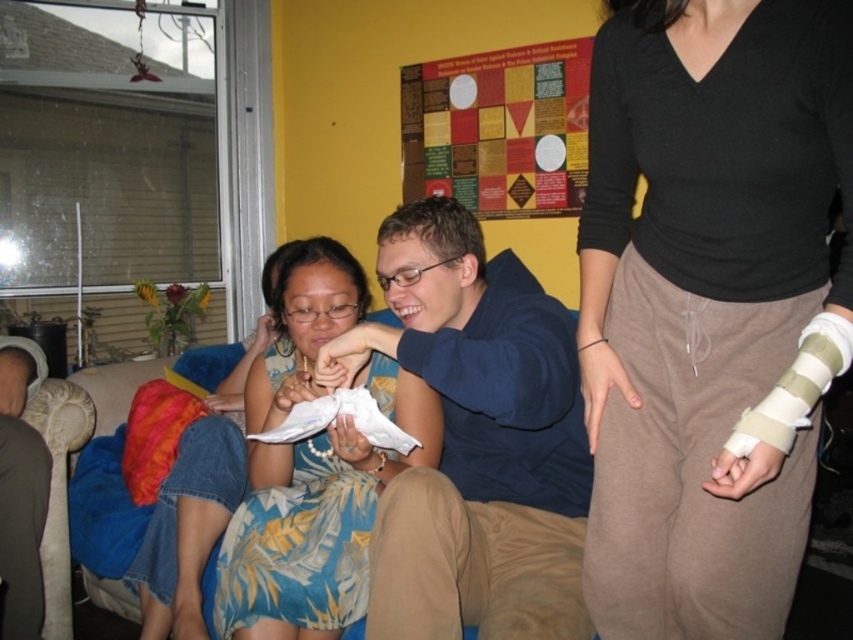
Which of these two, black matte arm cast at center or blue matte shirt at center, stands shorter?

blue matte shirt at center is shorter.

Between black matte arm cast at center and blue matte shirt at center, which one is positioned higher?

black matte arm cast at center

Locate an element on the screen. This screenshot has height=640, width=853. black matte arm cast at center is located at coordinates (709, 305).

Can you confirm if black matte arm cast at center is smaller than floral print dress at center?

Correct, black matte arm cast at center occupies less space than floral print dress at center.

Which of these two, black matte arm cast at center or floral print dress at center, stands taller?

black matte arm cast at center

Is point (767, 250) closer to camera compared to point (225, 586)?

Yes, point (767, 250) is closer to viewer.

In order to click on black matte arm cast at center in this screenshot , I will do tap(709, 305).

Is the position of blue matte shirt at center more distant than that of floral print dress at center?

No, blue matte shirt at center is closer to the viewer.

Is point (532, 584) farther from viewer compared to point (218, 566)?

No, it is not.

The width and height of the screenshot is (853, 640). In order to click on blue matte shirt at center in this screenshot , I will do `click(477, 442)`.